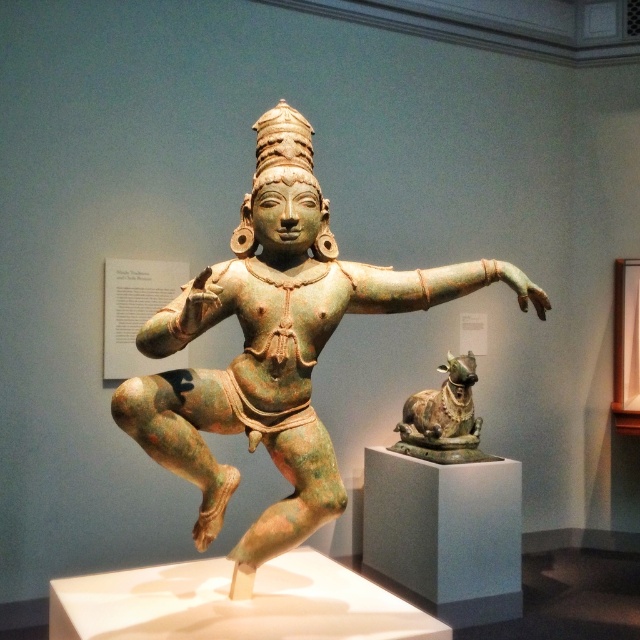
Question: Does green patinated bronze statue at center appear under green patinated bronze bull at center?

Choices:
 (A) yes
 (B) no

Answer: (B)

Question: Does green patinated bronze statue at center appear under green patinated bronze bull at center?

Choices:
 (A) yes
 (B) no

Answer: (B)

Question: Is green patinated bronze statue at center below green patinated bronze bull at center?

Choices:
 (A) yes
 (B) no

Answer: (B)

Question: Among these objects, which one is nearest to the camera?

Choices:
 (A) green patinated bronze bull at center
 (B) green patinated bronze statue at center

Answer: (B)

Question: Which of the following is the closest to the observer?

Choices:
 (A) (435, 420)
 (B) (371, 301)

Answer: (B)